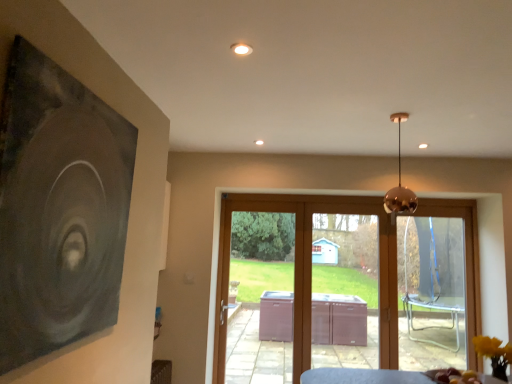
Question: Does brown wooden door at center appear on the right side of brown wood screen door at center?

Choices:
 (A) yes
 (B) no

Answer: (A)

Question: From the image's perspective, is brown wooden door at center beneath brown wood screen door at center?

Choices:
 (A) no
 (B) yes

Answer: (B)

Question: Considering the relative sizes of brown wooden door at center and brown wood screen door at center in the image provided, is brown wooden door at center thinner than brown wood screen door at center?

Choices:
 (A) no
 (B) yes

Answer: (A)

Question: From a real-world perspective, does brown wooden door at center sit lower than brown wood screen door at center?

Choices:
 (A) no
 (B) yes

Answer: (B)

Question: Is brown wood screen door at center inside brown wooden door at center?

Choices:
 (A) yes
 (B) no

Answer: (A)

Question: Considering the relative positions of dark matte painting at left and brown wood screen door at center in the image provided, is dark matte painting at left to the left or to the right of brown wood screen door at center?

Choices:
 (A) right
 (B) left

Answer: (B)

Question: Relative to brown wood screen door at center, is dark matte painting at left in front or behind?

Choices:
 (A) behind
 (B) front

Answer: (B)

Question: Based on their sizes in the image, would you say dark matte painting at left is bigger or smaller than brown wood screen door at center?

Choices:
 (A) small
 (B) big

Answer: (A)

Question: From the image's perspective, is dark matte painting at left above or below brown wood screen door at center?

Choices:
 (A) below
 (B) above

Answer: (B)

Question: Considering the positions of copper reflective pendant light at upper center and brown wood screen door at center in the image, is copper reflective pendant light at upper center wider or thinner than brown wood screen door at center?

Choices:
 (A) wide
 (B) thin

Answer: (A)

Question: From a real-world perspective, is copper reflective pendant light at upper center positioned above or below brown wood screen door at center?

Choices:
 (A) below
 (B) above

Answer: (B)

Question: Considering the relative positions of copper reflective pendant light at upper center and brown wood screen door at center in the image provided, is copper reflective pendant light at upper center to the left or to the right of brown wood screen door at center?

Choices:
 (A) left
 (B) right

Answer: (B)

Question: From the image's perspective, is copper reflective pendant light at upper center above or below brown wood screen door at center?

Choices:
 (A) above
 (B) below

Answer: (A)

Question: Is brown wooden door at center inside the boundaries of brown wood screen door at center, or outside?

Choices:
 (A) outside
 (B) inside

Answer: (A)

Question: Is brown wooden door at center to the left or to the right of brown wood screen door at center in the image?

Choices:
 (A) left
 (B) right

Answer: (B)